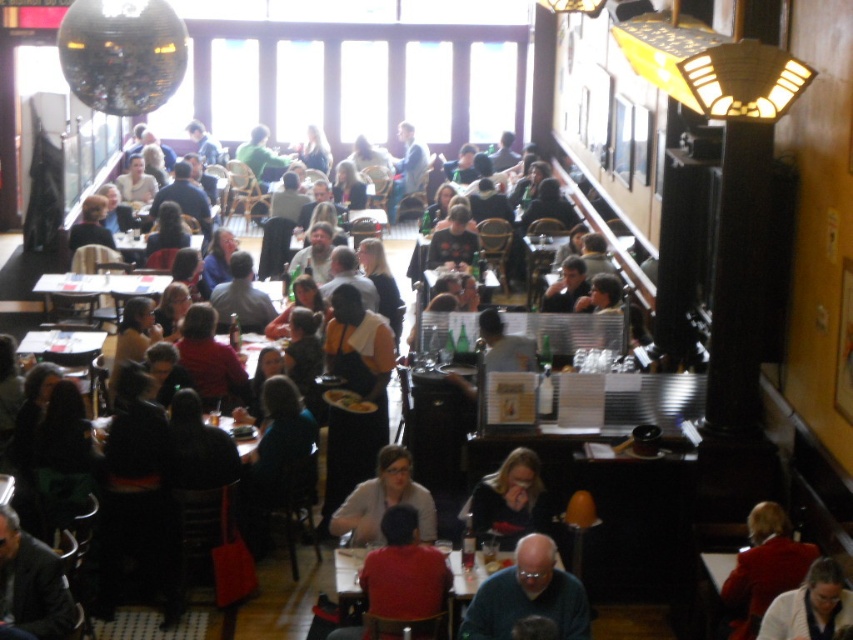
Question: Which point is closer to the camera taking this photo?

Choices:
 (A) (364, 637)
 (B) (567, 588)
 (C) (18, 600)
 (D) (381, 512)

Answer: (C)

Question: Is white fabric shirt at lower right below matte gray shirt at center?

Choices:
 (A) no
 (B) yes

Answer: (B)

Question: Can you confirm if gray sweater at center is positioned above matte black shirt at center?

Choices:
 (A) no
 (B) yes

Answer: (A)

Question: Is red velvet coat at lower right above matte black shirt at center?

Choices:
 (A) no
 (B) yes

Answer: (A)

Question: Which point appears closest to the camera in this image?

Choices:
 (A) click(x=561, y=579)
 (B) click(x=16, y=541)
 (C) click(x=792, y=544)
 (D) click(x=529, y=497)

Answer: (B)

Question: Which of the following is the closest to the observer?

Choices:
 (A) matte gray sweater at center
 (B) dark gray suit at lower left

Answer: (B)